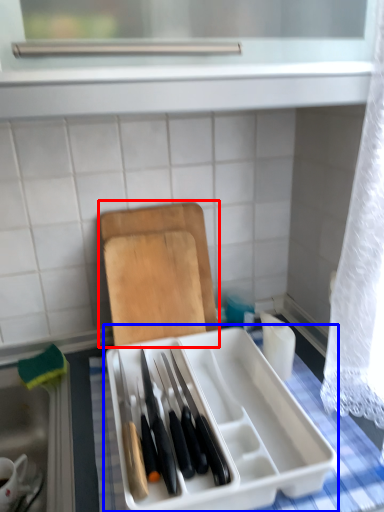
Question: Which point is closer to the camera, cutting board (highlighted by a red box) or appliance (highlighted by a blue box)?

Choices:
 (A) cutting board
 (B) appliance

Answer: (B)